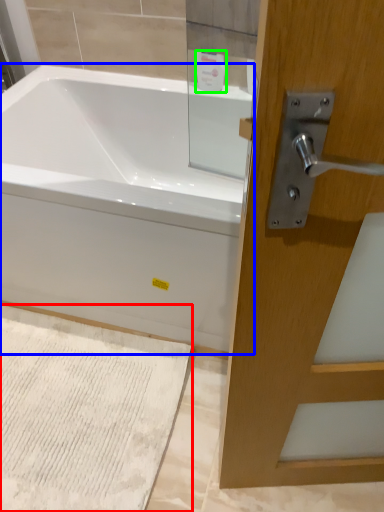
Question: Which object is the farthest from bath mat (highlighted by a red box)? Choose among these: bathtub (highlighted by a blue box) or toiletry (highlighted by a green box).

Choices:
 (A) bathtub
 (B) toiletry

Answer: (B)